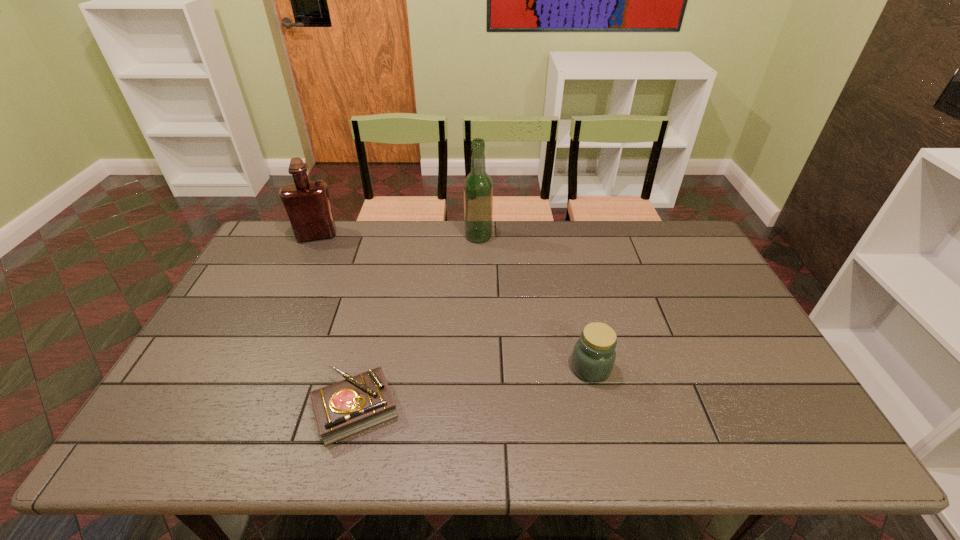
The width and height of the screenshot is (960, 540). I want to click on the second object from right to left, so click(x=478, y=187).

Find the location of `the right liquor`. the right liquor is located at coordinates (478, 187).

Find the location of a particular element. The width and height of the screenshot is (960, 540). the left liquor is located at coordinates (307, 203).

Locate an element on the screen. Image resolution: width=960 pixels, height=540 pixels. the second tallest object is located at coordinates (307, 203).

Locate an element on the screen. Image resolution: width=960 pixels, height=540 pixels. the rightmost object is located at coordinates (594, 354).

Where is `the third tallest object`? Image resolution: width=960 pixels, height=540 pixels. the third tallest object is located at coordinates (594, 354).

Locate an element on the screen. the shortest object is located at coordinates (350, 406).

This screenshot has height=540, width=960. Find the location of `the third object from right to left`. the third object from right to left is located at coordinates (350, 406).

This screenshot has height=540, width=960. What are the coordinates of `free space located 0.160m on the front of the taller liquor` in the screenshot? It's located at (478, 274).

You are a GUI agent. You are given a task and a screenshot of the screen. Output one action in this format:
    pyautogui.click(x=<x>, y=<y>)
    Task: Click on the vacant space situated 0.140m on the right of the leftmost object
    
    Given the screenshot: What is the action you would take?
    pyautogui.click(x=377, y=235)